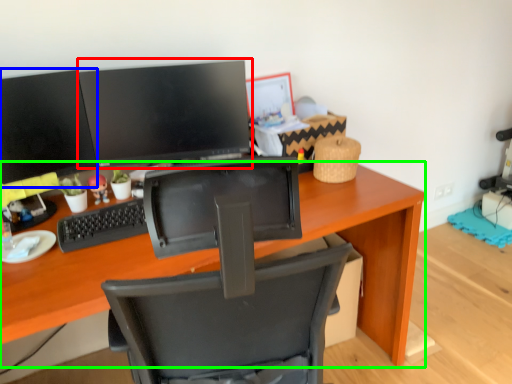
Question: Which object is positioned closest to computer monitor (highlighted by a red box)? Select from computer monitor (highlighted by a blue box) and desk (highlighted by a green box).

Choices:
 (A) computer monitor
 (B) desk

Answer: (A)